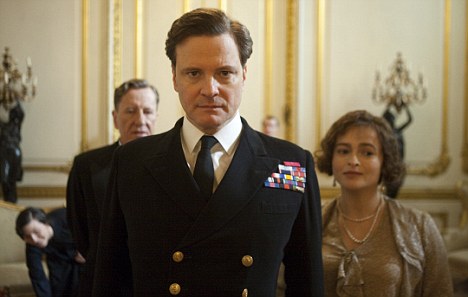
Find the location of a particular element. Image resolution: width=468 pixels, height=297 pixels. statue is located at coordinates (5, 138), (401, 126).